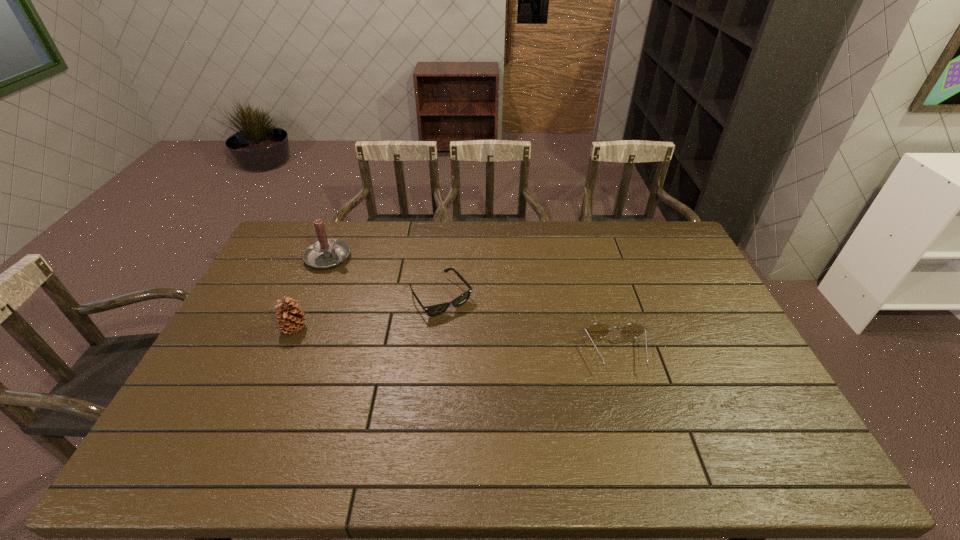
Find the location of `free space between the pinecone and the shortest object`. free space between the pinecone and the shortest object is located at coordinates (368, 313).

This screenshot has height=540, width=960. I want to click on unoccupied area between the third object from left to right and the rightmost object, so click(529, 325).

In order to click on vacant space that is in between the farthest object and the spectacles in this screenshot , I will do `click(473, 306)`.

Find the location of a particular element. object that stands as the closest to the shortest object is located at coordinates (326, 253).

Find the location of a particular element. The image size is (960, 540). object that stands as the third closest to the farthest object is located at coordinates (598, 330).